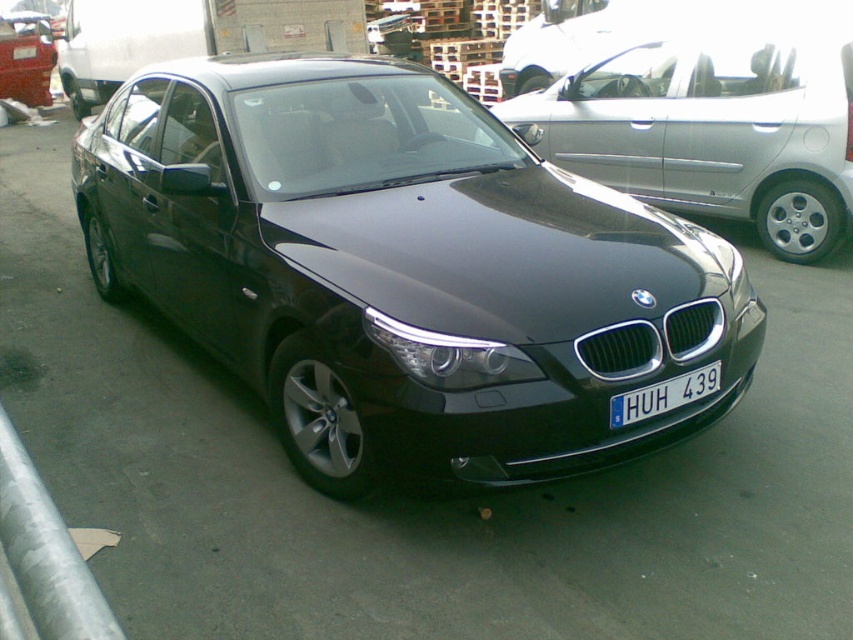
Based on the photo, between satin black car at center and blue metallic license plate at center, which one has more height?

With more height is satin black car at center.

Looking at this image, is satin black car at center further to the viewer compared to blue metallic license plate at center?

Yes, it is.

Who is more forward, (749, 51) or (704, 388)?

Point (704, 388) is in front.

Where is `satin black car at center`? The width and height of the screenshot is (853, 640). satin black car at center is located at coordinates (711, 132).

Does metallic gray curb at lower left have a smaller size compared to blue metallic license plate at center?

No.

Which is behind, point (41, 637) or point (648, 406)?

The point (648, 406) is more distant.

I want to click on metallic gray curb at lower left, so click(41, 560).

Can you confirm if satin black car at center is smaller than metallic gray curb at lower left?

Actually, satin black car at center might be larger than metallic gray curb at lower left.

Does satin black car at center appear on the right side of metallic gray curb at lower left?

Correct, you'll find satin black car at center to the right of metallic gray curb at lower left.

This screenshot has height=640, width=853. What do you see at coordinates (711, 132) in the screenshot?
I see `satin black car at center` at bounding box center [711, 132].

The width and height of the screenshot is (853, 640). I want to click on satin black car at center, so click(x=711, y=132).